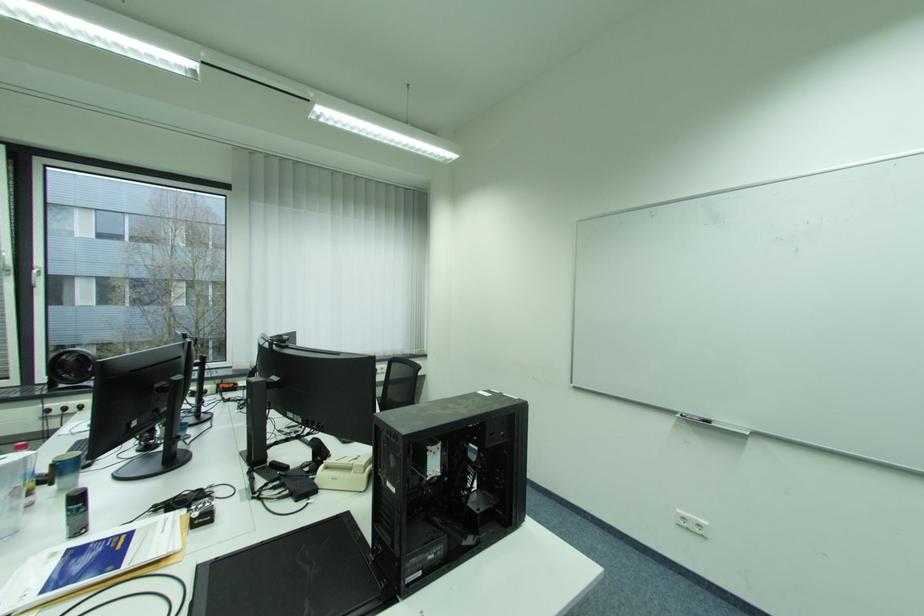
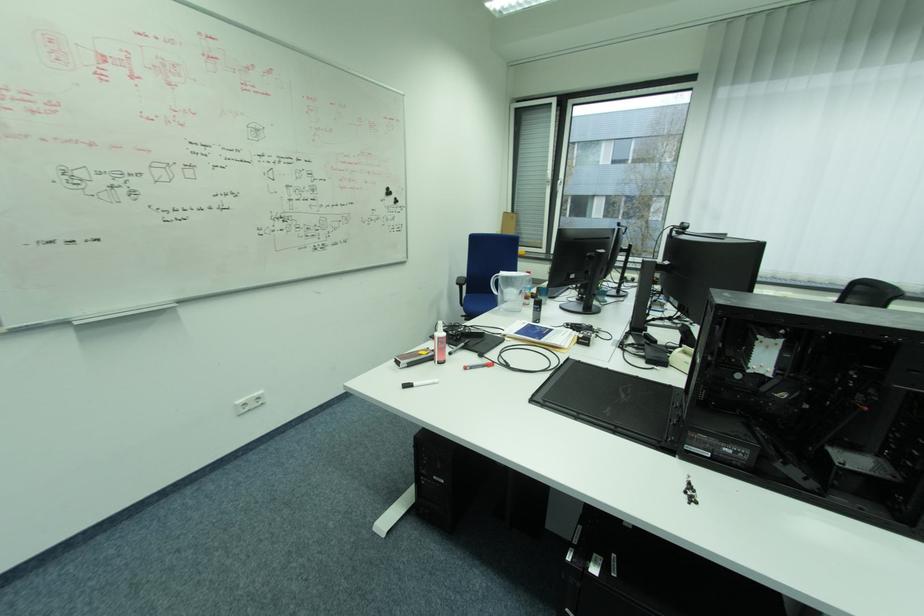
First-person continuous shooting, in which direction is the camera rotating?

The rotation direction of the camera is left-down.